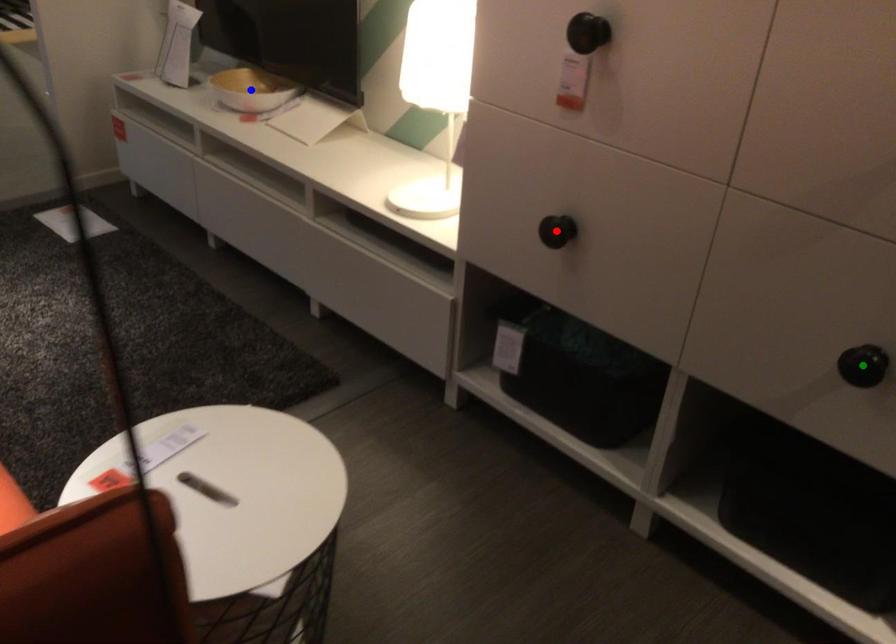
Order these from nearest to farthest:
A) green point
B) red point
C) blue point

1. green point
2. red point
3. blue point